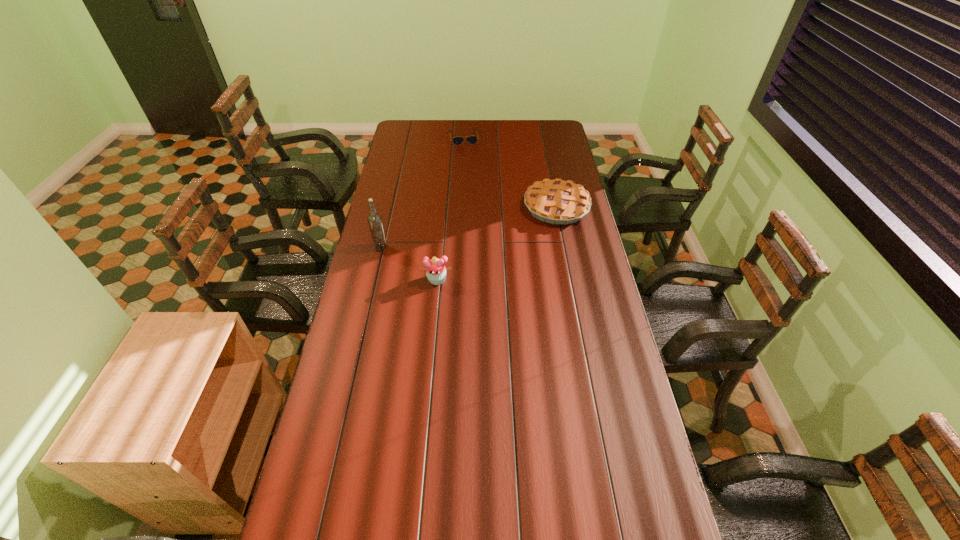
In the image, there is a desktop. At what (x,y) coordinates should I click in order to perform the action: click on free space at the left edge. Please return your answer as a coordinate pair (x, y). Looking at the image, I should click on (352, 358).

Find the location of `vacant space at the right edge of the desktop`. vacant space at the right edge of the desktop is located at coordinates [x=613, y=383].

I want to click on vacant space that's between the third tallest object and the leftmost object, so click(x=468, y=227).

Where is `free point between the farthest object and the tallest object`? The height and width of the screenshot is (540, 960). free point between the farthest object and the tallest object is located at coordinates (422, 192).

You are a GUI agent. You are given a task and a screenshot of the screen. Output one action in this format:
    pyautogui.click(x=<x>, y=<y>)
    Task: Click on the empty space between the shortest object and the second tallest object
    This screenshot has width=960, height=540.
    Given the screenshot: What is the action you would take?
    pyautogui.click(x=450, y=208)

Where is `vacant space that's between the second shortest object and the nearest object`? The height and width of the screenshot is (540, 960). vacant space that's between the second shortest object and the nearest object is located at coordinates (496, 244).

Locate an element on the screen. The height and width of the screenshot is (540, 960). free space between the sunglasses and the pie is located at coordinates click(x=510, y=172).

Locate an element on the screen. This screenshot has width=960, height=540. free spot between the tallest object and the shortest object is located at coordinates 422,192.

Where is `free point between the pie and the cupcake`? free point between the pie and the cupcake is located at coordinates (496, 244).

The height and width of the screenshot is (540, 960). What are the coordinates of `vacant point located between the shortest object and the third nearest object` in the screenshot? It's located at (510, 172).